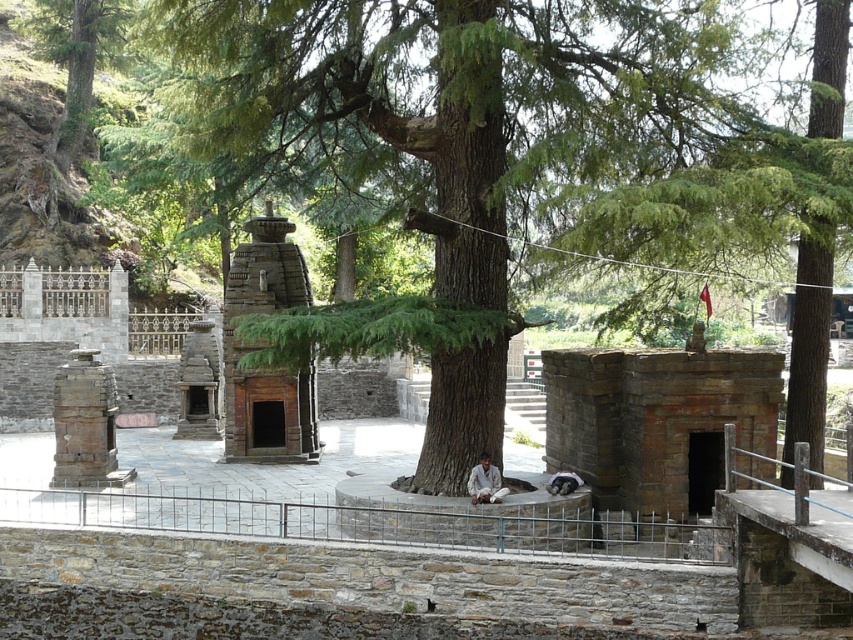
Image resolution: width=853 pixels, height=640 pixels. I want to click on green rough bark tree at center, so click(x=467, y=144).

In the scene shown: Does green rough bark tree at center have a greater height compared to metal/rustic rail at center?

Yes.

Image resolution: width=853 pixels, height=640 pixels. What do you see at coordinates (467, 144) in the screenshot?
I see `green rough bark tree at center` at bounding box center [467, 144].

Locate an element on the screen. green rough bark tree at center is located at coordinates (467, 144).

Can you confirm if metal/rustic rail at center is positioned below white cotton dhoti at center?

Yes.

Between metal/rustic rail at center and white cotton dhoti at center, which one is positioned higher?

white cotton dhoti at center is higher up.

Which is in front, point (281, 538) or point (486, 472)?

Point (281, 538) is in front.

Find the location of a particular element. The height and width of the screenshot is (640, 853). metal/rustic rail at center is located at coordinates (381, 524).

Which is in front, point (287, 148) or point (473, 496)?

Point (473, 496)

Between green rough bark tree at center and white cotton dhoti at center, which one has more height?

green rough bark tree at center

At what (x,y) coordinates should I click in order to perform the action: click on green rough bark tree at center. Please return your answer as a coordinate pair (x, y). The height and width of the screenshot is (640, 853). Looking at the image, I should click on (467, 144).

The width and height of the screenshot is (853, 640). I want to click on green rough bark tree at center, so click(467, 144).